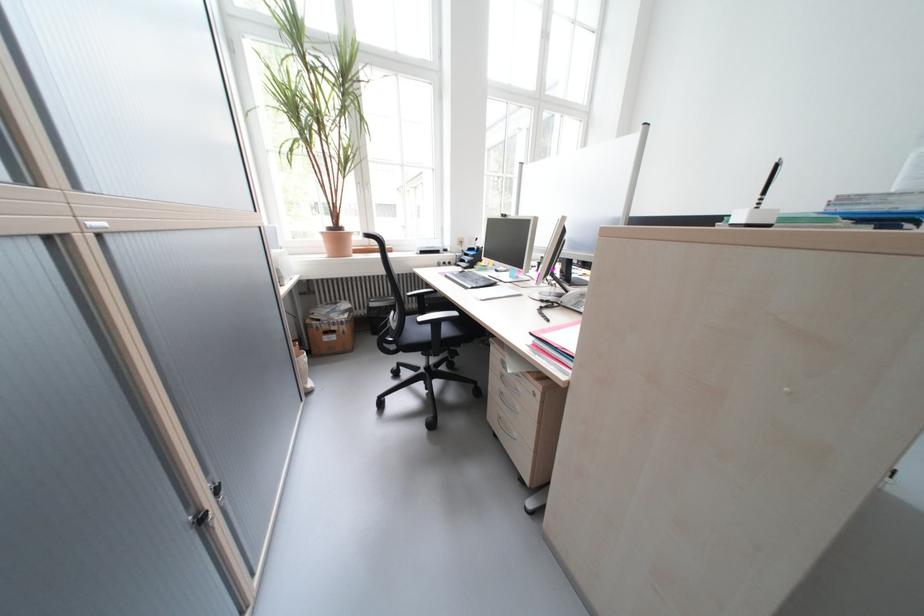
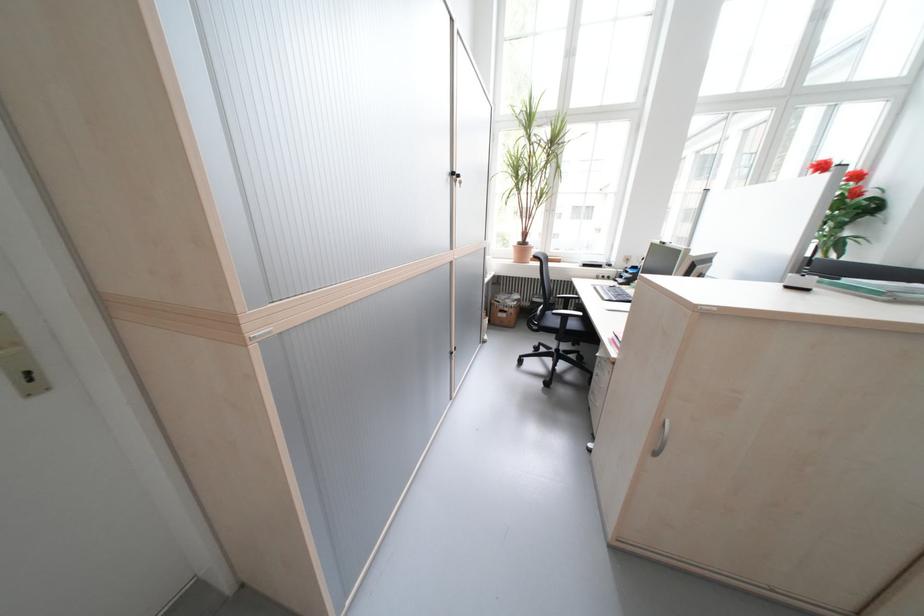
Where in the second image is the point corresponding to point 464,262 from the first image?

(623, 278)